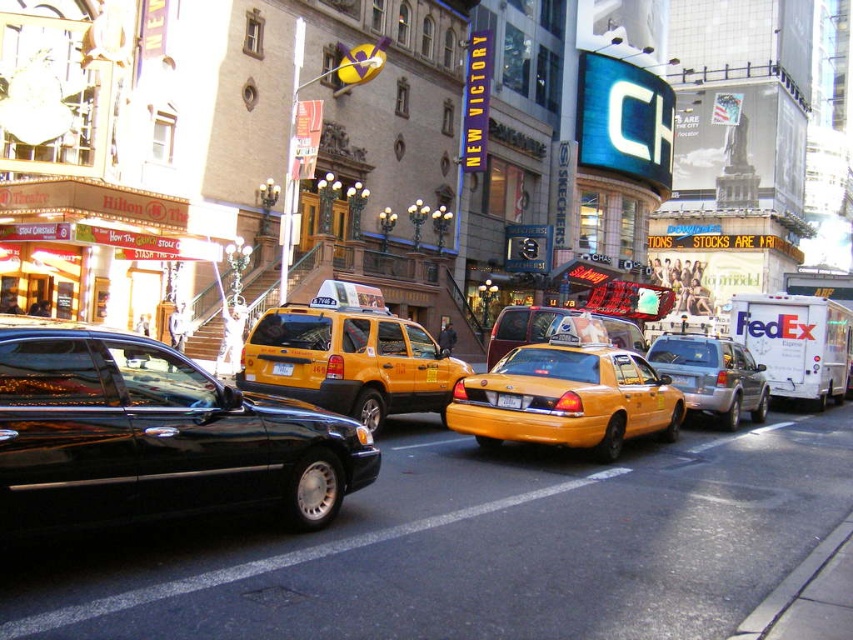
Question: Is yellow matte taxi at center to the right of yellow plastic taxi at center from the viewer's perspective?

Choices:
 (A) no
 (B) yes

Answer: (B)

Question: Among these objects, which one is nearest to the camera?

Choices:
 (A) yellow rubber taxi at center
 (B) yellow matte taxi at center
 (C) yellow rubber taxi cab at center
 (D) silver metallic suv at center

Answer: (B)

Question: Does silver metallic suv at center appear on the right side of yellow plastic license plate at center?

Choices:
 (A) yes
 (B) no

Answer: (A)

Question: Can you confirm if shiny black sedan at center is positioned to the right of silver metallic suv at center?

Choices:
 (A) yes
 (B) no

Answer: (B)

Question: Which object is farther from the camera taking this photo?

Choices:
 (A) yellow rubber taxi cab at center
 (B) shiny black sedan at center
 (C) silver metallic suv at center
 (D) yellow rubber taxi at center

Answer: (C)

Question: Which of the following is the farthest from the observer?

Choices:
 (A) shiny black sedan at center
 (B) yellow rubber taxi at center
 (C) yellow rubber taxi cab at center
 (D) yellow matte taxi at center

Answer: (C)